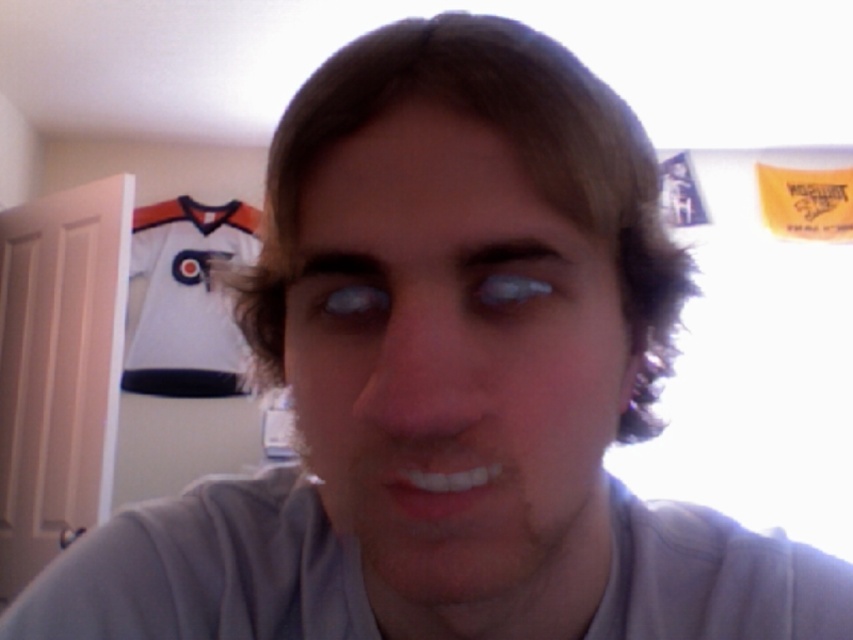
You are a photographer adjusting the lighting in a studio. You notice the matte gray face at center and the blue matte eye at center in your viewfinder. Which object should you focus on to ensure the subject is properly lit?

The matte gray face at center is in front of the blue matte eye at center, so you should focus on the matte gray face at center to ensure proper lighting on the subject.

You are a photographer setting up a portrait shoot in a studio. You have two subjects in the frame, a matte gray face at center and a gray cotton shirt at center. Based on the scene description, which object occupies more vertical space in the image?

The matte gray face at center is much taller than the gray cotton shirt at center, so it occupies more vertical space in the image.